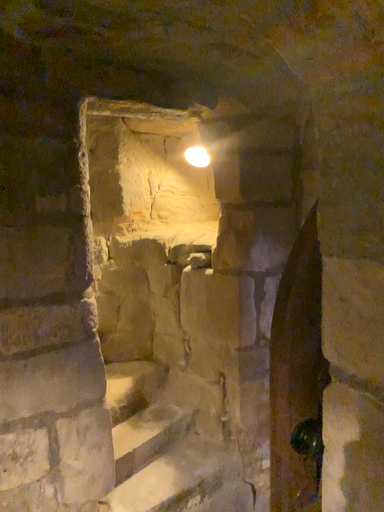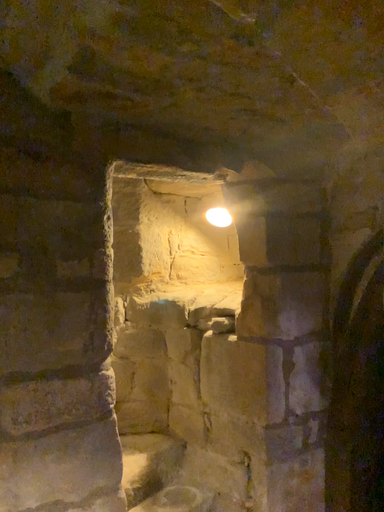
Question: Which way did the camera rotate in the video?

Choices:
 (A) rotated downward
 (B) rotated upward

Answer: (B)